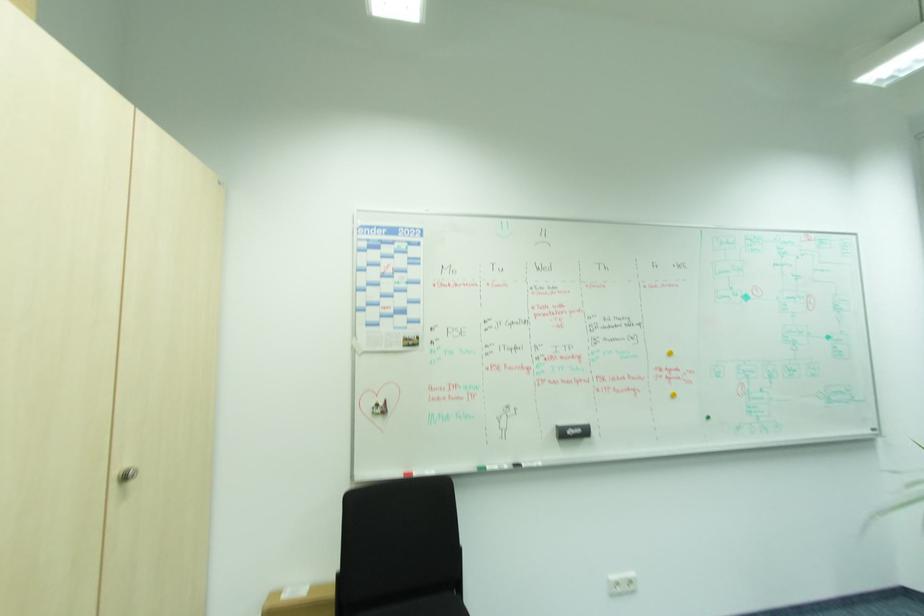
The location [492,467] corresponds to which object?

It corresponds to the green whiteboard marker in the image.